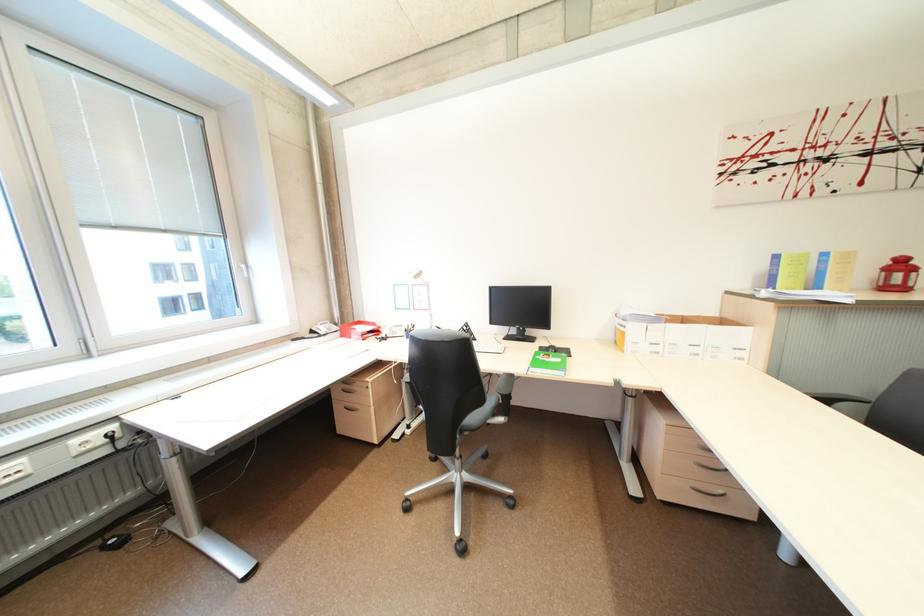
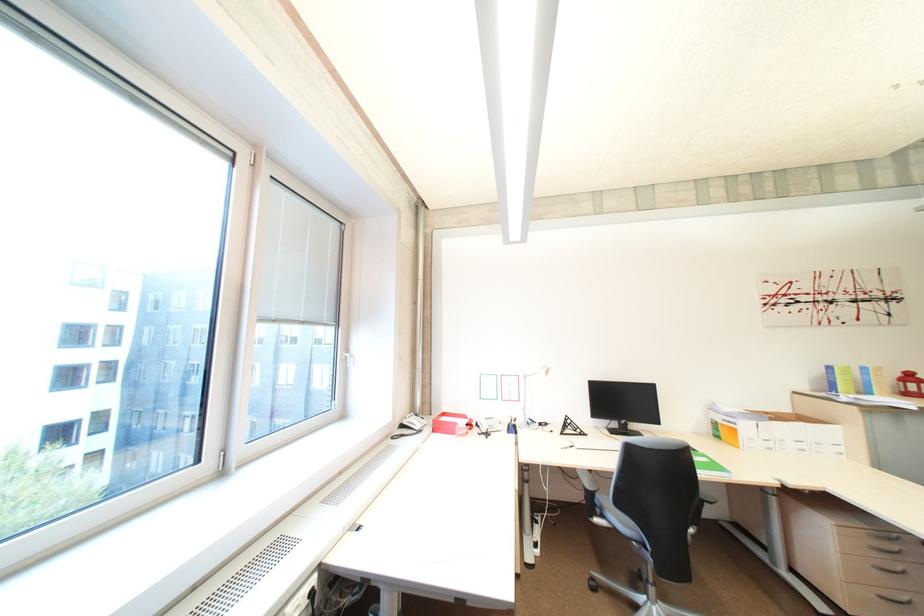
Find the pixel in the second image that matches point 896,270 in the first image.

(913, 382)